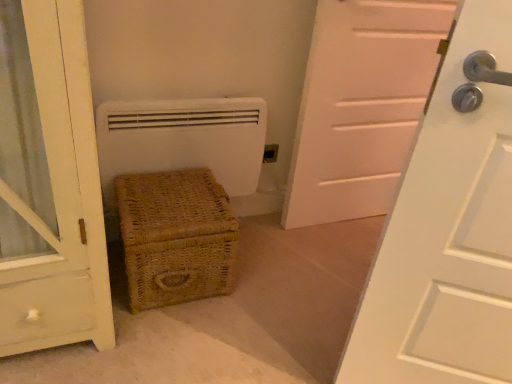
At what (x,y) coordinates should I click in order to perform the action: click on vacant space that's between white matte door at center and woven brown basket at lower left. Please return your answer as a coordinate pair (x, y). This screenshot has height=384, width=512. Looking at the image, I should click on pyautogui.click(x=294, y=247).